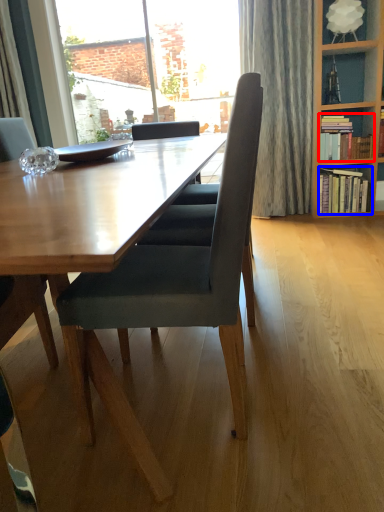
Question: Which of the following is the farthest to the observer, book (highlighted by a red box) or book (highlighted by a blue box)?

Choices:
 (A) book
 (B) book

Answer: (B)